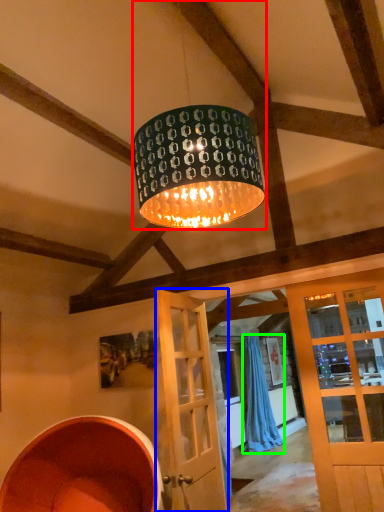
Question: Estimate the real-world distances between objects in this image. Which object is closer to lamp (highlighted by a red box), door (highlighted by a blue box) or curtain (highlighted by a green box)?

Choices:
 (A) door
 (B) curtain

Answer: (A)